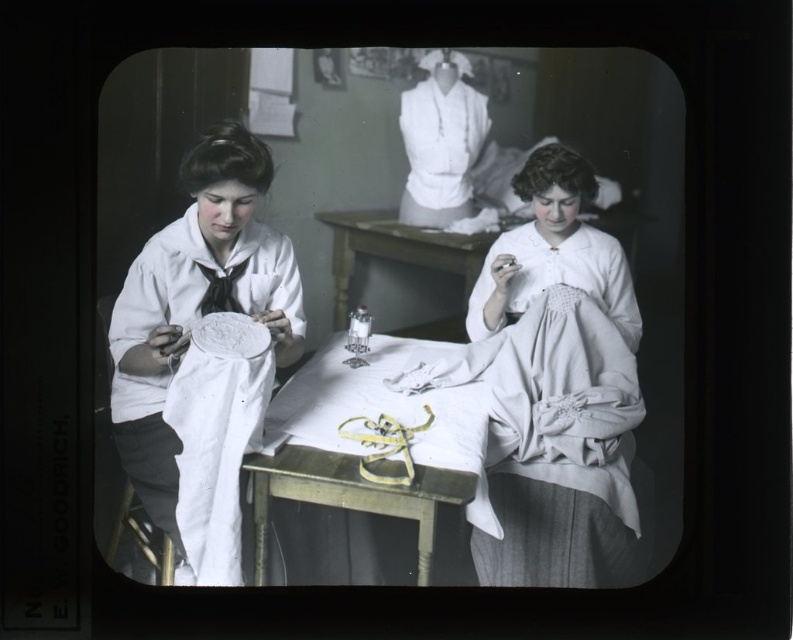
Question: Is the position of matte white fabric at center less distant than that of smooth white table at center?

Choices:
 (A) no
 (B) yes

Answer: (B)

Question: Which point is closer to the camera?

Choices:
 (A) white matte fabric at left
 (B) white cotton blouse at upper center

Answer: (A)

Question: Among these points, which one is farthest from the camera?

Choices:
 (A) (439, 189)
 (B) (592, 554)

Answer: (A)

Question: Which point is farther from the camera taking this photo?

Choices:
 (A) (470, 106)
 (B) (458, 244)
 (C) (627, 536)

Answer: (B)

Question: Is wooden table at center positioned at the back of white matte fabric at left?

Choices:
 (A) yes
 (B) no

Answer: (B)

Question: Does white matte fabric at left appear on the right side of smooth white table at center?

Choices:
 (A) no
 (B) yes

Answer: (A)